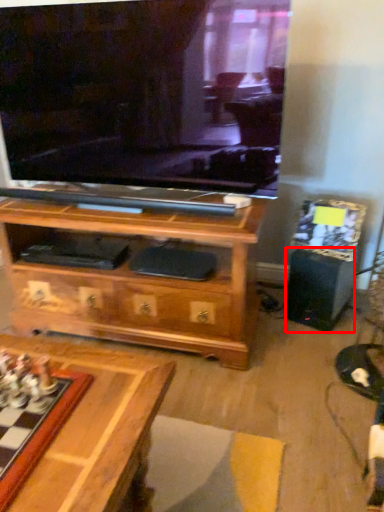
Question: From the image's perspective, where is speaker (annotated by the red box) located relative to board game?

Choices:
 (A) below
 (B) above

Answer: (B)